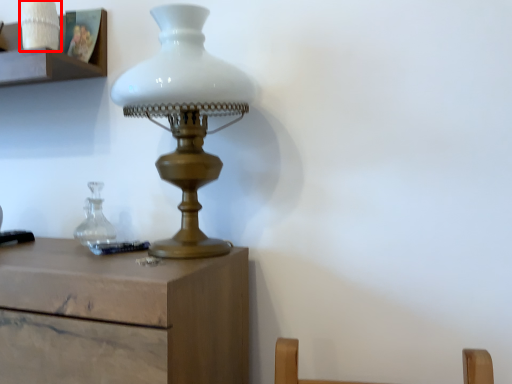
Question: From the image's perspective, where is candle holder (annotated by the red box) located in relation to lamp in the image?

Choices:
 (A) above
 (B) below

Answer: (A)